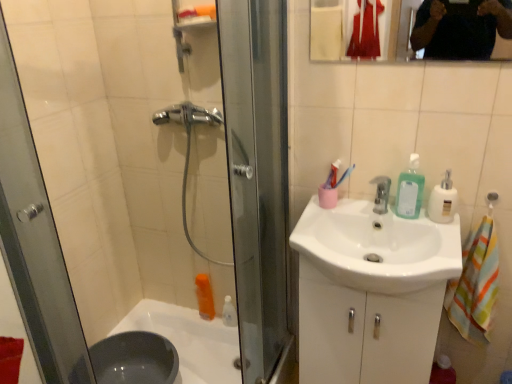
This screenshot has width=512, height=384. What do you see at coordinates (410, 190) in the screenshot? I see `green translucent liquid soap at upper right` at bounding box center [410, 190].

What is the approximate height of green translucent liquid soap at upper right?

The height of green translucent liquid soap at upper right is 8.36 inches.

The image size is (512, 384). What are the coordinates of `white glossy sink at center` in the screenshot? It's located at (377, 247).

You are a GUI agent. You are given a task and a screenshot of the screen. Output one action in this format:
    pyautogui.click(x=<x>, y=<y>)
    Task: Click on the tap that appears above the multicolored fabric towel at right (from a real-world perspective)
    
    Given the screenshot: What is the action you would take?
    pyautogui.click(x=381, y=194)

Between point (376, 178) and point (493, 254), which one is positioned in front?

The point (493, 254) is closer.

From a real-world perspective, is silver metallic faucet at center above or below multicolored fabric towel at right?

silver metallic faucet at center is situated higher than multicolored fabric towel at right in the real world.

What's the angular difference between white glossy cabinet at lower right and white plastic soap dispenser at right's facing directions?

white glossy cabinet at lower right and white plastic soap dispenser at right are facing 0.572 degrees away from each other.

Is white glossy cabinet at lower right next to white plastic soap dispenser at right?

white glossy cabinet at lower right and white plastic soap dispenser at right are clearly separated.

Considering the positions of objects white glossy cabinet at lower right and white plastic soap dispenser at right in the image provided, who is more to the left, white glossy cabinet at lower right or white plastic soap dispenser at right?

white glossy cabinet at lower right is more to the left.

Is white glossy sink at center aimed at white plastic soap dispenser at right?

No, white glossy sink at center is not oriented towards white plastic soap dispenser at right.

Considering the sizes of objects white glossy sink at center and white plastic soap dispenser at right in the image provided, who is smaller, white glossy sink at center or white plastic soap dispenser at right?

Smaller between the two is white plastic soap dispenser at right.

Considering the positions of point (345, 255) and point (455, 192), is point (345, 255) closer or farther from the camera than point (455, 192)?

Point (345, 255) is positioned closer to the camera compared to point (455, 192).

Looking at this image, is white glossy bathtub at lower left facing away from green translucent liquid soap at upper right?

No, white glossy bathtub at lower left is not facing the opposite direction of green translucent liquid soap at upper right.

Choose the correct answer: Is white glossy bathtub at lower left inside green translucent liquid soap at upper right or outside it?

The correct answer is: outside.

From the picture: Does white glossy bathtub at lower left have a lesser height compared to green translucent liquid soap at upper right?

Yes, white glossy bathtub at lower left is shorter than green translucent liquid soap at upper right.

Which object is thinner, white glossy bathtub at lower left or green translucent liquid soap at upper right?

green translucent liquid soap at upper right is thinner.

Is white plastic soap dispenser at right next to white glossy bathtub at lower left and touching it?

No, white plastic soap dispenser at right is not touching white glossy bathtub at lower left.

Measure the distance from white plastic soap dispenser at right to white glossy bathtub at lower left.

A distance of 1.17 meters exists between white plastic soap dispenser at right and white glossy bathtub at lower left.

Is white plastic soap dispenser at right wider or thinner than white glossy bathtub at lower left?

In the image, white plastic soap dispenser at right appears to be more narrow than white glossy bathtub at lower left.

From a real-world perspective, is white plastic soap dispenser at right beneath multicolored fabric towel at right?

No.

Looking at this image, which object is closer to the camera, white plastic soap dispenser at right or multicolored fabric towel at right?

multicolored fabric towel at right is more forward.

Image resolution: width=512 pixels, height=384 pixels. What are the coordinates of `tap to the right of white glossy bathtub at lower left` in the screenshot? It's located at (381, 194).

From the image's perspective, between white glossy bathtub at lower left and silver metallic faucet at center, which one is located above?

From the image's view, silver metallic faucet at center is above.

From a real-world perspective, is white glossy bathtub at lower left positioned above or below silver metallic faucet at center?

In terms of real-world spatial position, white glossy bathtub at lower left is below silver metallic faucet at center.

Between white glossy bathtub at lower left and silver metallic faucet at center, which one appears on the right side from the viewer's perspective?

silver metallic faucet at center.

Where is `tap on the left of multicolored fabric towel at right`? This screenshot has width=512, height=384. tap on the left of multicolored fabric towel at right is located at coordinates (381, 194).

In the image, there is a white plastic soap dispenser at right. Where is `bathroom cabinet below it (from the image's perspective)`? The height and width of the screenshot is (384, 512). bathroom cabinet below it (from the image's perspective) is located at coordinates (365, 331).

Based on their spatial positions, is green translucent liquid soap at upper right or white glossy cabinet at lower right further from multicolored fabric towel at right?

green translucent liquid soap at upper right is further to multicolored fabric towel at right.

Considering their positions, is white glossy bathtub at lower left positioned closer to green translucent liquid soap at upper right than white glossy cabinet at lower right?

white glossy cabinet at lower right lies closer to green translucent liquid soap at upper right than the other object.

Looking at the image, which one is located further to white glossy sink at center, white glossy bathtub at lower left or multicolored fabric towel at right?

Among the two, white glossy bathtub at lower left is located further to white glossy sink at center.

Estimate the real-world distances between objects in this image. Which object is further from multicolored fabric towel at right, silver metallic faucet at center or white glossy bathtub at lower left?

white glossy bathtub at lower left.

Based on their spatial positions, is white glossy cabinet at lower right or silver metallic faucet at center further from white glossy sink at center?

silver metallic faucet at center is further to white glossy sink at center.

Looking at the image, which one is located closer to multicolored fabric towel at right, white glossy sink at center or white glossy bathtub at lower left?

Among the two, white glossy sink at center is located nearer to multicolored fabric towel at right.

When comparing their distances from white glossy sink at center, does silver metallic faucet at center or white glossy cabinet at lower right seem further?

silver metallic faucet at center is further to white glossy sink at center.

Consider the image. Which object lies further to the anchor point white glossy bathtub at lower left, green translucent liquid soap at upper right or white glossy sink at center?

green translucent liquid soap at upper right.

This screenshot has width=512, height=384. I want to click on toiletry between silver metallic faucet at center and white plastic soap dispenser at right, so click(x=410, y=190).

The height and width of the screenshot is (384, 512). In order to click on tap between green translucent liquid soap at upper right and white glossy cabinet at lower right in the up-down direction in this screenshot , I will do `click(381, 194)`.

Identify the location of bathroom cabinet located between white glossy bathtub at lower left and multicolored fabric towel at right in the left-right direction. This screenshot has width=512, height=384. (365, 331).

Find the location of a particular element. tap between white glossy sink at center and white plastic soap dispenser at right from left to right is located at coordinates click(381, 194).